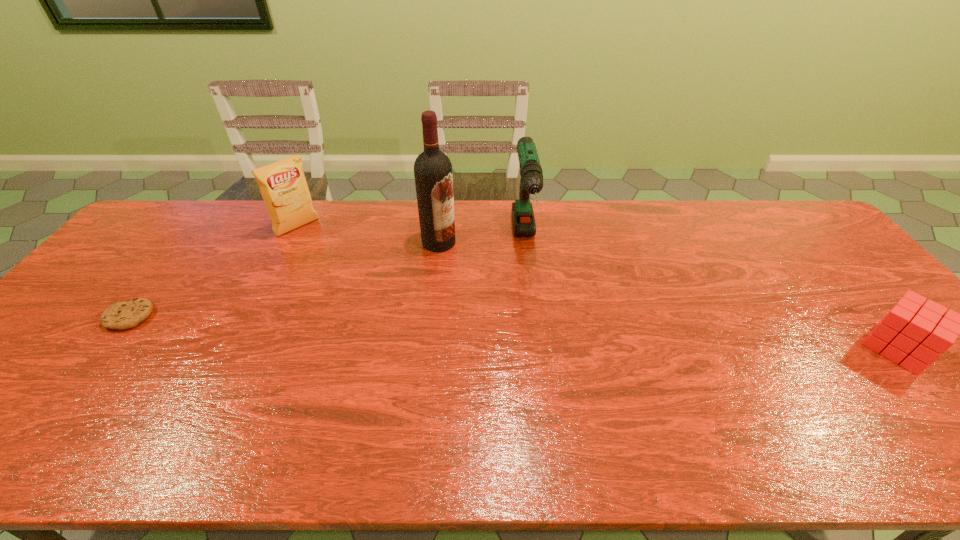
Point out which object is positioned as the fourth nearest to the second tallest object. Please provide its 2D coordinates. Your answer should be formatted as a tuple, i.e. [(x, y)], where the tuple contains the x and y coordinates of a point satisfying the conditions above.

[(122, 315)]

The height and width of the screenshot is (540, 960). I want to click on object that stands as the second closest to the second object from right to left, so click(283, 186).

Find the location of `vacant space that satisfies the following two spatial constraints: 1. on the front side of the fourth tallest object; 2. on the right side of the third object from right to left`. vacant space that satisfies the following two spatial constraints: 1. on the front side of the fourth tallest object; 2. on the right side of the third object from right to left is located at coordinates (427, 348).

The width and height of the screenshot is (960, 540). I want to click on free space that satisfies the following two spatial constraints: 1. on the front side of the tallest object; 2. on the right side of the second shortest object, so click(x=427, y=348).